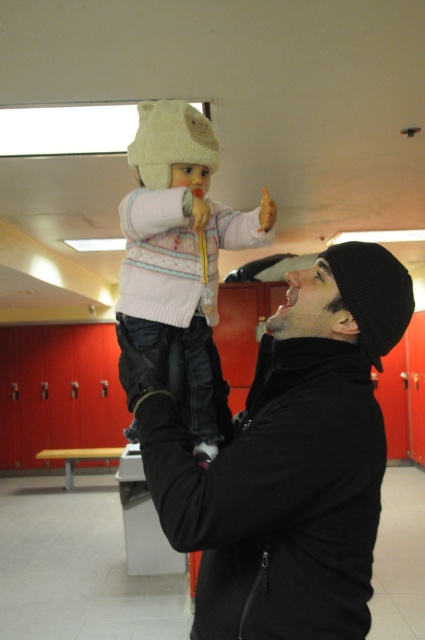
Identify the location of black matte jacket at center. (285, 458).

Can you confirm if black matte jacket at center is smaller than white knitted sweater at center?

No.

Which is behind, point (155, 372) or point (204, 326)?

Point (204, 326)

You are a GUI agent. You are given a task and a screenshot of the screen. Output one action in this format:
    pyautogui.click(x=<x>, y=<y>)
    Task: Click on the black matte jacket at center
    Image resolution: width=425 pixels, height=640 pixels.
    Given the screenshot: What is the action you would take?
    pyautogui.click(x=285, y=458)